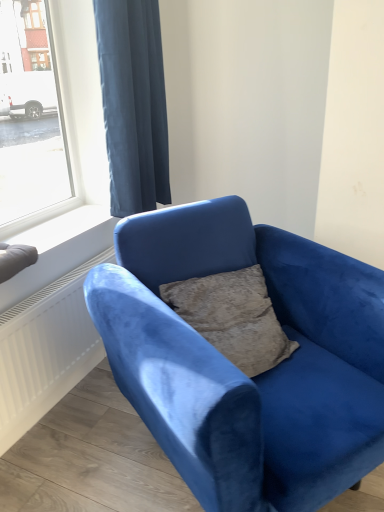
Question: Is velvet blue couch at center to the left or to the right of dark blue fabric curtain at upper left in the image?

Choices:
 (A) left
 (B) right

Answer: (B)

Question: Relative to dark blue fabric curtain at upper left, is velvet blue couch at center in front or behind?

Choices:
 (A) front
 (B) behind

Answer: (A)

Question: Considering the real-world distances, which object is farthest from the velvet blue couch at center?

Choices:
 (A) dark blue fabric curtain at upper left
 (B) white smooth window sill at lower left

Answer: (A)

Question: Estimate the real-world distances between objects in this image. Which object is farther from the dark blue fabric curtain at upper left?

Choices:
 (A) white smooth window sill at lower left
 (B) velvet blue couch at center

Answer: (B)